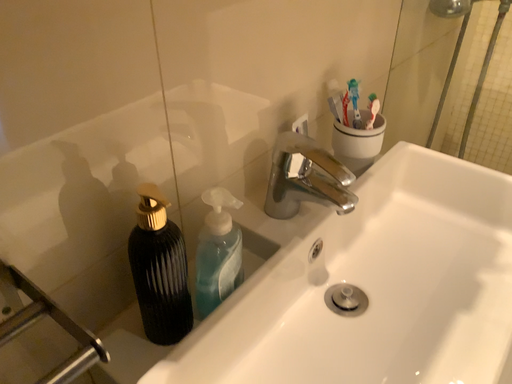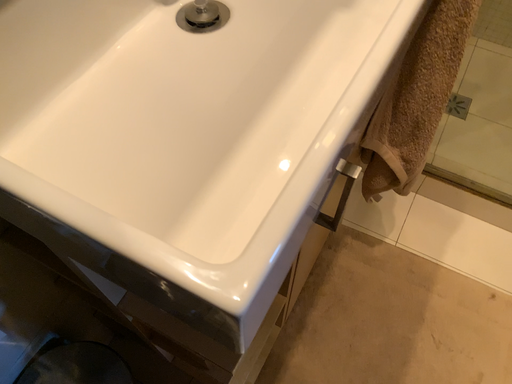
Question: How did the camera likely rotate when shooting the video?

Choices:
 (A) rotated downward
 (B) rotated upward

Answer: (A)